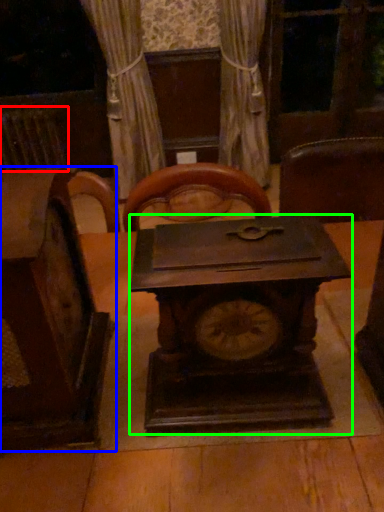
Question: Considering the real-world distances, which object is closest to radiator (highlighted by a red box)? furniture (highlighted by a blue box) or clock (highlighted by a green box).

Choices:
 (A) furniture
 (B) clock

Answer: (A)